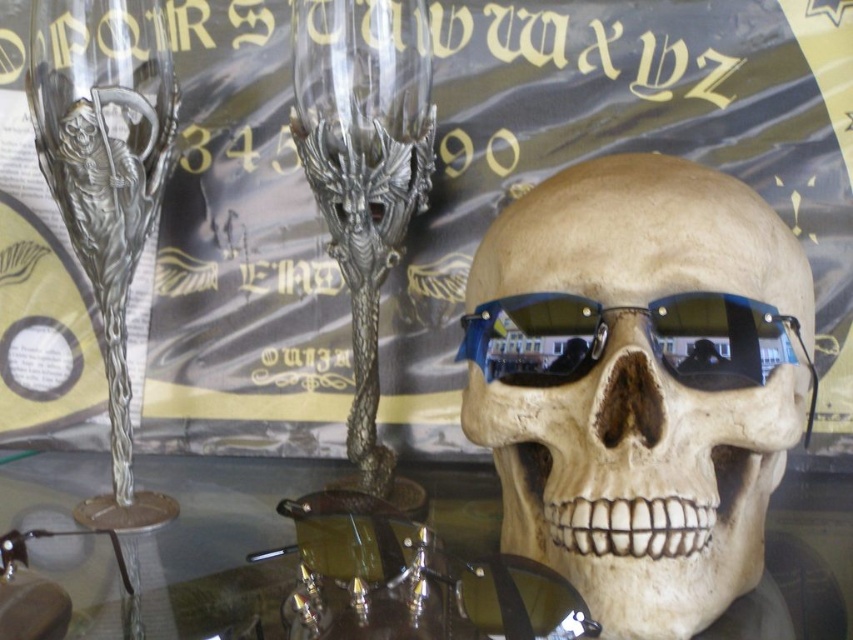
You are at an event and want to grab the silver metallic wine glass at left without touching the metallic silver poster at center. Is this possible given their positions?

The metallic silver poster at center is positioned over the silver metallic wine glass at left, so you can reach the silver metallic wine glass at left by moving the poster out of the way or accessing it from the side without disturbing the poster.

You are at an art exhibition and see the metallic silver poster at center and the metallic silver wine glass at center. Which object is taller?

The metallic silver poster at center is taller than the metallic silver wine glass at center.